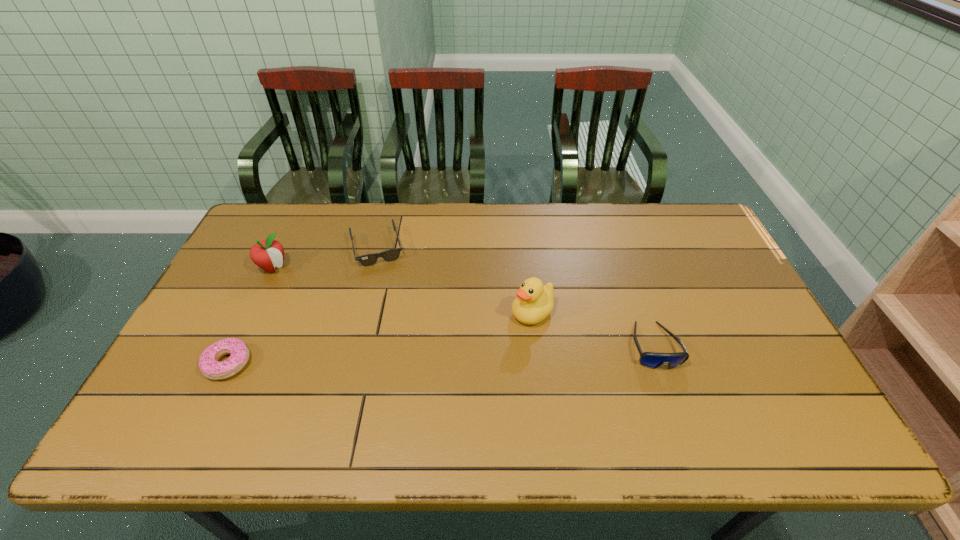
Where is `vacant space on the desktop that is between the doughnut and the rightmost object and is positioned on the side where a bite is taken out of the second tallest object`? Image resolution: width=960 pixels, height=540 pixels. vacant space on the desktop that is between the doughnut and the rightmost object and is positioned on the side where a bite is taken out of the second tallest object is located at coordinates tap(388, 356).

Identify the location of vacant space on the desktop that is between the doughnut and the nearer sunglasses and is positioned on the temples of the third object from right to left. (403, 356).

The image size is (960, 540). What are the coordinates of `vacant space on the desktop that is between the doughnut and the taller sunglasses and is positioned at the beak of the tallest object` in the screenshot? It's located at (472, 353).